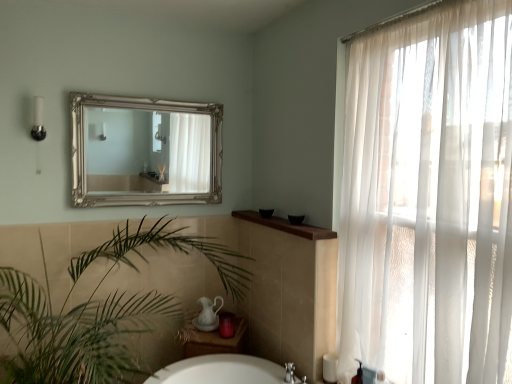
Measure the distance between green leafy plant at lower left and camera.

1.65 meters.

Measure the distance between point (297, 234) and camera.

The depth of point (297, 234) is 2.16 meters.

Where is `brown wood counter top at upper center`? brown wood counter top at upper center is located at coordinates (286, 225).

Find the location of a particular element. The width and height of the screenshot is (512, 384). black plastic soap dispenser at lower right is located at coordinates (358, 374).

What is the approximate width of black plastic soap dispenser at lower right?

black plastic soap dispenser at lower right is 6.35 centimeters wide.

What do you see at coordinates (141, 157) in the screenshot? The image size is (512, 384). I see `silver ornate mirror at upper center` at bounding box center [141, 157].

In order to face silver ornate mirror at upper center, should I rotate leftwards or rightwards?

You should rotate left by 13.508 degrees.

What are the coordinates of `green leafy plant at lower left` in the screenshot? It's located at (100, 312).

Does point (488, 182) come farther from viewer compared to point (215, 188)?

No.

Between sheer white curtain at right and silver ornate mirror at upper center, which one has more height?

Standing taller between the two is sheer white curtain at right.

In terms of width, does sheer white curtain at right look wider or thinner when compared to silver ornate mirror at upper center?

Clearly, sheer white curtain at right has more width compared to silver ornate mirror at upper center.

Is sheer white curtain at right closer to the viewer compared to silver ornate mirror at upper center?

Yes, sheer white curtain at right is closer to the viewer.

Looking at this image, from a real-world perspective, is green leafy plant at lower left over brown wood counter top at upper center?

Incorrect, from a real-world perspective, green leafy plant at lower left is lower than brown wood counter top at upper center.

Based on the photo, does green leafy plant at lower left have a greater width compared to brown wood counter top at upper center?

Correct, the width of green leafy plant at lower left exceeds that of brown wood counter top at upper center.

How many degrees apart are the facing directions of green leafy plant at lower left and brown wood counter top at upper center?

The facing directions of green leafy plant at lower left and brown wood counter top at upper center are 89 degrees apart.

Is green leafy plant at lower left far away from brown wood counter top at upper center?

No, green leafy plant at lower left is in close proximity to brown wood counter top at upper center.

From a real-world perspective, which object stands above the other?

sheer white curtain at right, from a real-world perspective.

Which point is more distant from viewer, (453,199) or (7,314)?

Positioned behind is point (7,314).

Is sheer white curtain at right wider than green leafy plant at lower left?

No.

Is black plastic soap dispenser at lower right at the back of sheer white curtain at right?

Yes, sheer white curtain at right is facing away from black plastic soap dispenser at lower right.

Consider the image. Does sheer white curtain at right have a lesser height compared to black plastic soap dispenser at lower right?

Incorrect, the height of sheer white curtain at right does not fall short of that of black plastic soap dispenser at lower right.

Measure the distance from sheer white curtain at right to black plastic soap dispenser at lower right.

A distance of 84.44 centimeters exists between sheer white curtain at right and black plastic soap dispenser at lower right.

Choose the correct answer: Is sheer white curtain at right inside black plastic soap dispenser at lower right or outside it?

sheer white curtain at right lies outside black plastic soap dispenser at lower right.

Which of these two, green leafy plant at lower left or silver ornate mirror at upper center, is thinner?

silver ornate mirror at upper center.

Is green leafy plant at lower left oriented towards silver ornate mirror at upper center?

No.

Identify the location of medicine cabinet that is behind the green leafy plant at lower left. This screenshot has width=512, height=384. (141, 157).

Is the surface of green leafy plant at lower left in direct contact with silver ornate mirror at upper center?

green leafy plant at lower left and silver ornate mirror at upper center are clearly separated.

Is brown wood counter top at upper center at the back of sheer white curtain at right?

No.

Identify the location of counter top on the left of sheer white curtain at right. This screenshot has width=512, height=384. (286, 225).

Measure the distance from sheer white curtain at right to brown wood counter top at upper center.

24.81 inches.

Which object is more forward, sheer white curtain at right or brown wood counter top at upper center?

sheer white curtain at right.

Is black plastic soap dispenser at lower right positioned beyond the bounds of brown wood counter top at upper center?

black plastic soap dispenser at lower right lies outside brown wood counter top at upper center's area.

Could you tell me if black plastic soap dispenser at lower right is turned towards brown wood counter top at upper center?

No, black plastic soap dispenser at lower right is not oriented towards brown wood counter top at upper center.

From a real-world perspective, is black plastic soap dispenser at lower right beneath brown wood counter top at upper center?

Yes, from a real-world perspective, black plastic soap dispenser at lower right is under brown wood counter top at upper center.

Would you say black plastic soap dispenser at lower right is a long distance from brown wood counter top at upper center?

black plastic soap dispenser at lower right is actually quite close to brown wood counter top at upper center.

Where is `medicine cabinet behind the sheer white curtain at right`? Image resolution: width=512 pixels, height=384 pixels. medicine cabinet behind the sheer white curtain at right is located at coordinates (141, 157).

Where is `houseplant below the brown wood counter top at upper center (from the image's perspective)`? houseplant below the brown wood counter top at upper center (from the image's perspective) is located at coordinates tap(100, 312).

Estimate the real-world distances between objects in this image. Which object is closer to black plastic soap dispenser at lower right, brown wood counter top at upper center or green leafy plant at lower left?

brown wood counter top at upper center.

Considering their positions, is black plastic soap dispenser at lower right positioned further to sheer white curtain at right than green leafy plant at lower left?

Among the two, green leafy plant at lower left is located further to sheer white curtain at right.

When comparing their distances from green leafy plant at lower left, does brown wood counter top at upper center or black plastic soap dispenser at lower right seem further?

black plastic soap dispenser at lower right.

From the image, which object appears to be nearer to sheer white curtain at right, green leafy plant at lower left or brown wood counter top at upper center?

Among the two, brown wood counter top at upper center is located nearer to sheer white curtain at right.

In the scene shown: From the image, which object appears to be nearer to sheer white curtain at right, silver ornate mirror at upper center or green leafy plant at lower left?

Among the two, green leafy plant at lower left is located nearer to sheer white curtain at right.

Looking at the image, which one is located further to silver ornate mirror at upper center, black plastic soap dispenser at lower right or green leafy plant at lower left?

Based on the image, black plastic soap dispenser at lower right appears to be further to silver ornate mirror at upper center.

Estimate the real-world distances between objects in this image. Which object is further from black plastic soap dispenser at lower right, sheer white curtain at right or green leafy plant at lower left?

green leafy plant at lower left is further to black plastic soap dispenser at lower right.

Which object lies further to the anchor point brown wood counter top at upper center, silver ornate mirror at upper center or black plastic soap dispenser at lower right?

black plastic soap dispenser at lower right.

You are a GUI agent. You are given a task and a screenshot of the screen. Output one action in this format:
    pyautogui.click(x=<x>, y=<y>)
    Task: Click on the toiletry situated between silver ornate mirror at upper center and sheer white curtain at right from left to right
    
    Given the screenshot: What is the action you would take?
    pyautogui.click(x=358, y=374)

Image resolution: width=512 pixels, height=384 pixels. Find the location of `counter top between green leafy plant at lower left and sheer white curtain at right`. counter top between green leafy plant at lower left and sheer white curtain at right is located at coordinates (286, 225).

Locate an element on the screen. The width and height of the screenshot is (512, 384). counter top between silver ornate mirror at upper center and black plastic soap dispenser at lower right in the horizontal direction is located at coordinates pyautogui.click(x=286, y=225).

Locate an element on the screen. counter top between green leafy plant at lower left and black plastic soap dispenser at lower right in the horizontal direction is located at coordinates (286, 225).